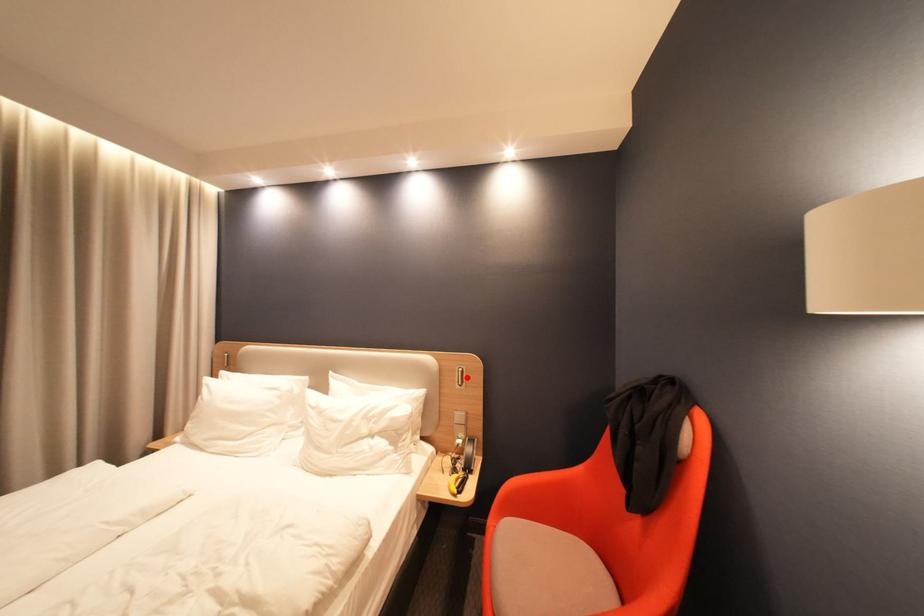
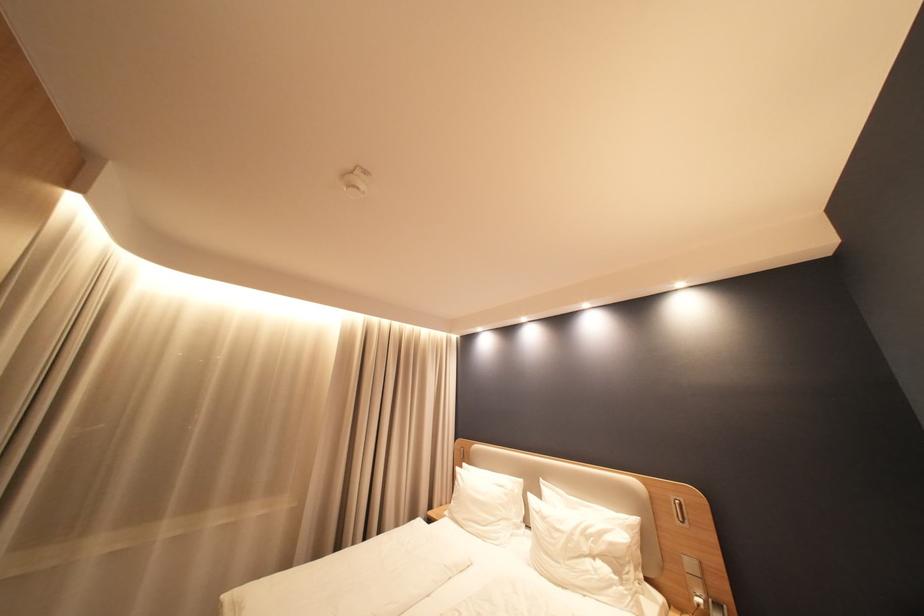
Where in the second image is the point corresponding to the highlighted location from the first image?

(685, 511)